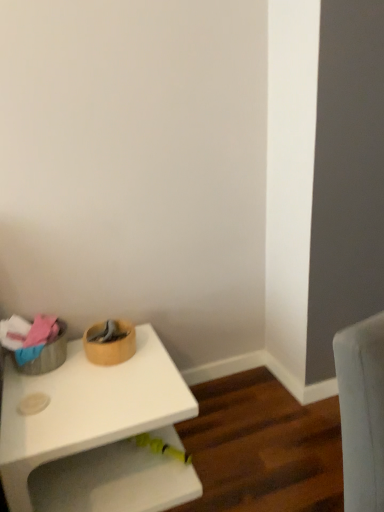
Locate an element on the screen. The height and width of the screenshot is (512, 384). free point above white matte table at lower left (from a real-world perspective) is located at coordinates (93, 385).